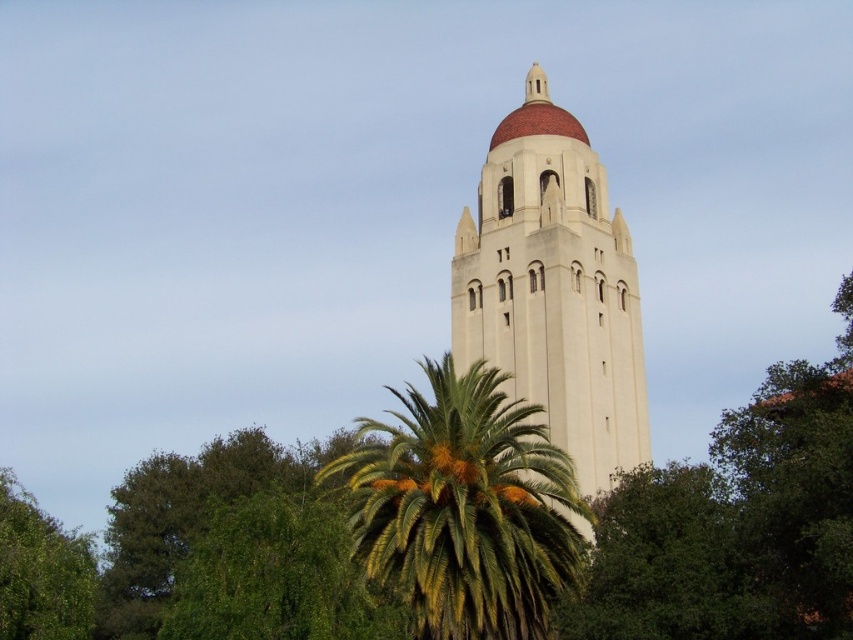
Question: Does green leafy palm at center appear over green leafy tree at lower left?

Choices:
 (A) yes
 (B) no

Answer: (A)

Question: Can you confirm if white stucco tower at center is smaller than green leafy tree at lower left?

Choices:
 (A) no
 (B) yes

Answer: (B)

Question: Which object appears farthest from the camera in this image?

Choices:
 (A) green leafy tree at lower left
 (B) green leafy palm at center
 (C) white stucco tower at center

Answer: (C)

Question: Which of the following is the closest to the observer?

Choices:
 (A) (4, 618)
 (B) (428, 580)
 (C) (607, 355)

Answer: (B)

Question: Can you confirm if white stucco tower at center is positioned to the right of green leafy palm at center?

Choices:
 (A) no
 (B) yes

Answer: (B)

Question: Which is nearer to the green leafy palm at center?

Choices:
 (A) green leafy tree at lower left
 (B) white stucco tower at center

Answer: (B)